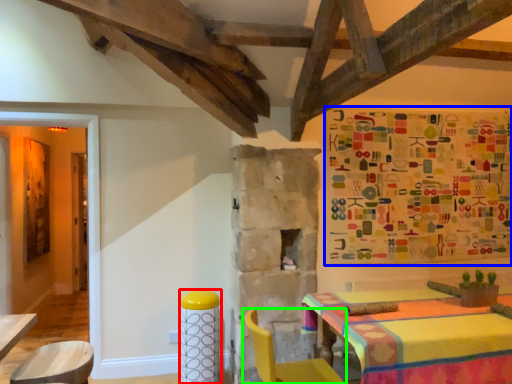
Question: Which object is the farthest from bar stool (highlighted by a red box)? Choose among these: tapestry (highlighted by a blue box) or chair (highlighted by a green box).

Choices:
 (A) tapestry
 (B) chair

Answer: (A)